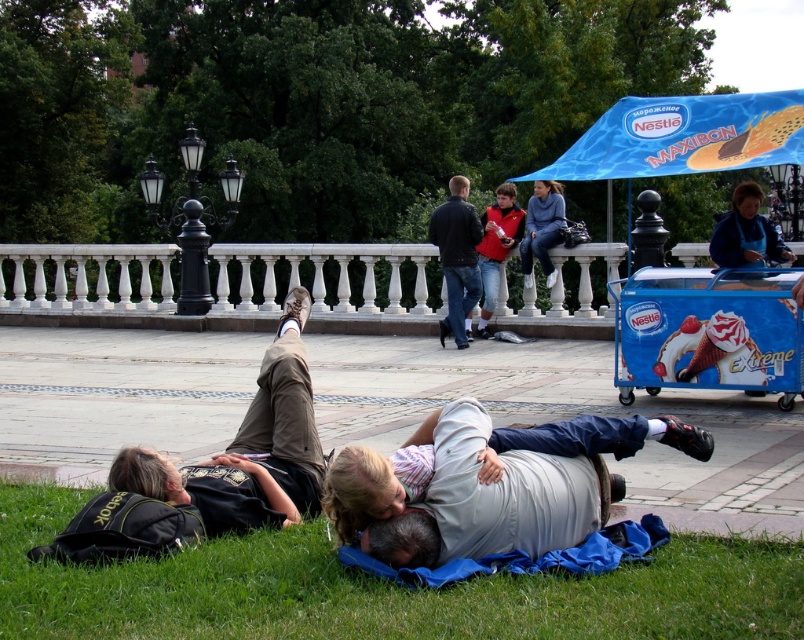
You are a photographer trying to capture a photo of the blue cotton sweater at center without including the white marble balustrade at upper center in the frame. Based on their positions, is this possible?

The white marble balustrade at upper center is to the left of the blue cotton sweater at center, so if you position your camera to the right side of the blue cotton sweater at center, you can exclude the balustrade from the frame.

You are one of the people lying on the grass and want to reach the blue plastic cart at lower right without getting up. Can you reach it from your current position near the brown cotton pants at lower center?

The blue plastic cart at lower right is further to the viewer than the brown cotton pants at lower center, so you can reach it without getting up because it is closer to you.